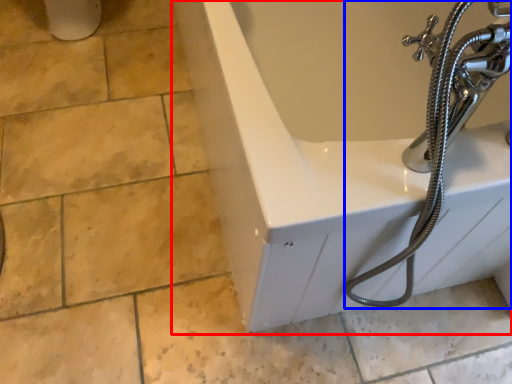
Question: Which object is further to the camera taking this photo, bathtub (highlighted by a red box) or garden hose (highlighted by a blue box)?

Choices:
 (A) bathtub
 (B) garden hose

Answer: (A)